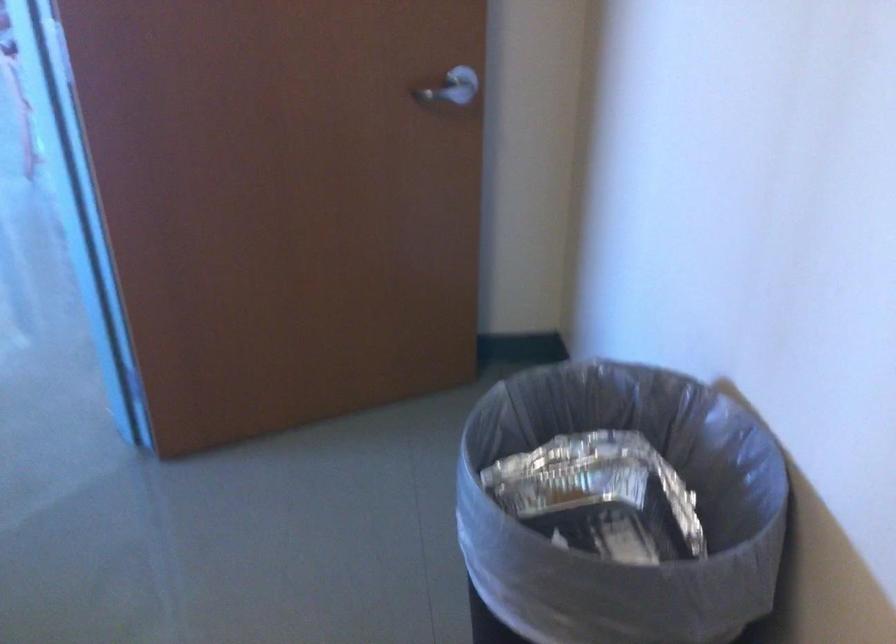
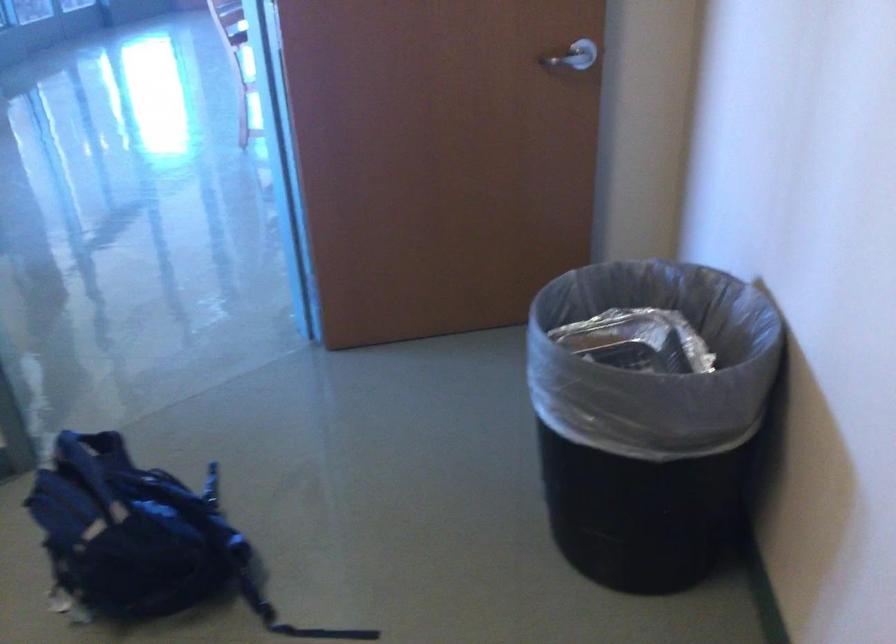
Locate, in the second image, the point that corresponds to point (453, 104) in the first image.

(571, 60)